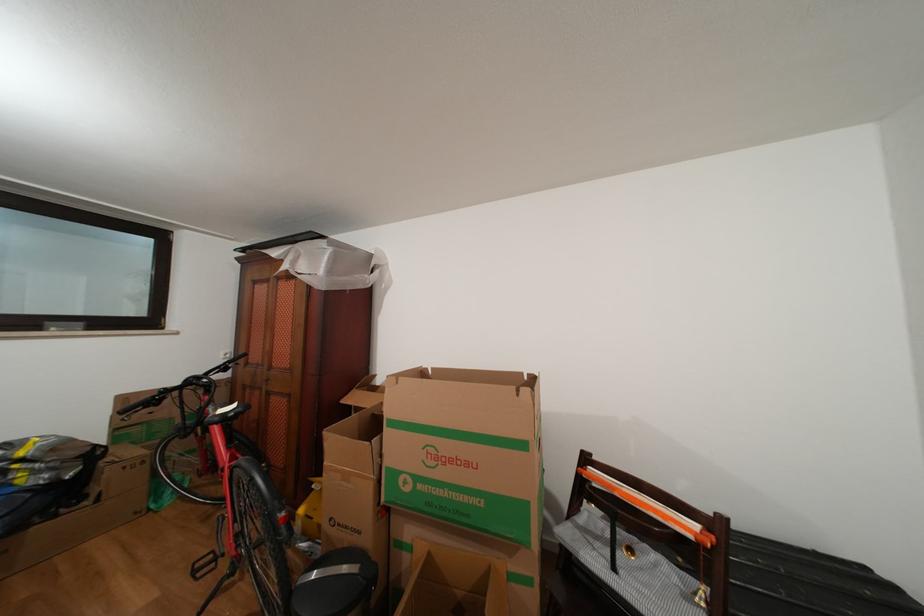
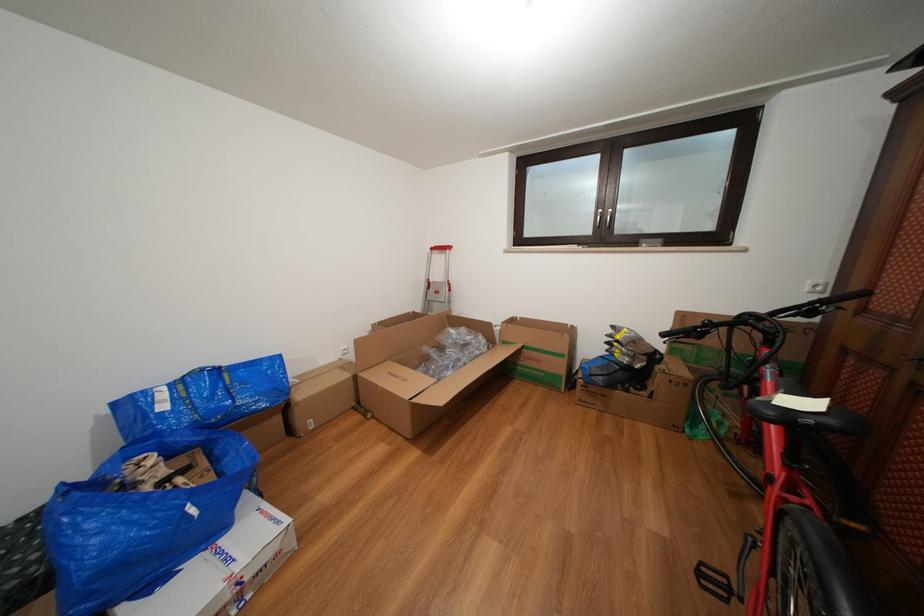
In the second image, find the point that corresponds to point 237,367 in the first image.

(831, 307)